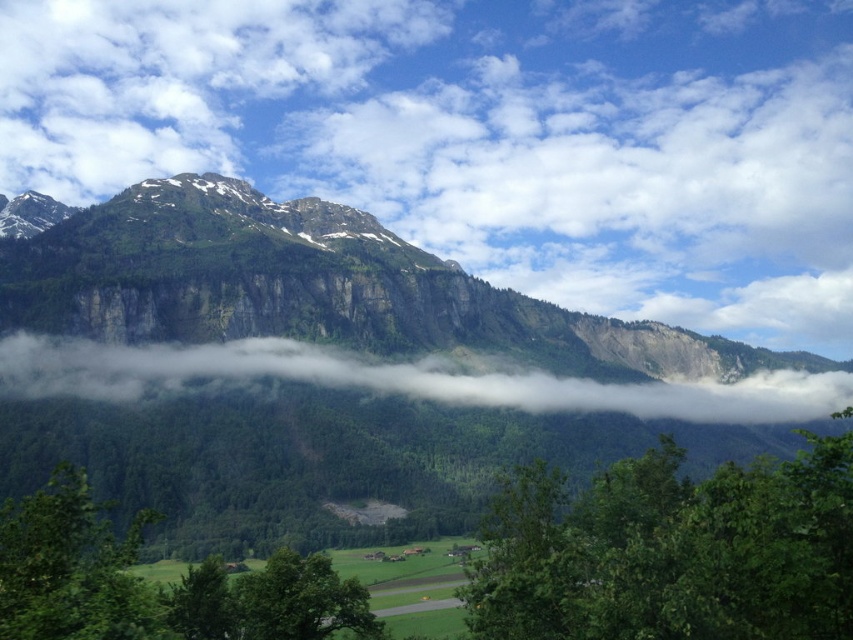
Is point (622, 474) less distant than point (454, 388)?

Yes, it is.

Does green leafy tree at lower right have a larger size compared to white fluffy fog at center?

Incorrect, green leafy tree at lower right is not larger than white fluffy fog at center.

Is point (498, 600) behind point (320, 365)?

No, it is in front of (320, 365).

This screenshot has width=853, height=640. What are the coordinates of `green leafy tree at lower right` in the screenshot? It's located at click(670, 550).

How much distance is there between white fluffy fog at center and green leafy tree at lower center?

A distance of 160.29 meters exists between white fluffy fog at center and green leafy tree at lower center.

Where is `white fluffy fog at center`? white fluffy fog at center is located at coordinates (397, 380).

The width and height of the screenshot is (853, 640). I want to click on white fluffy fog at center, so click(x=397, y=380).

Is white fluffy cloud at upper center bigger than white fluffy fog at center?

Yes, white fluffy cloud at upper center is bigger than white fluffy fog at center.

Consider the image. Who is more distant from viewer, (123, 161) or (604, 410)?

The point (123, 161) is more distant.

Does point (476, 164) lie behind point (77, 364)?

Yes, point (476, 164) is behind point (77, 364).

Identify the location of white fluffy cloud at upper center. (485, 136).